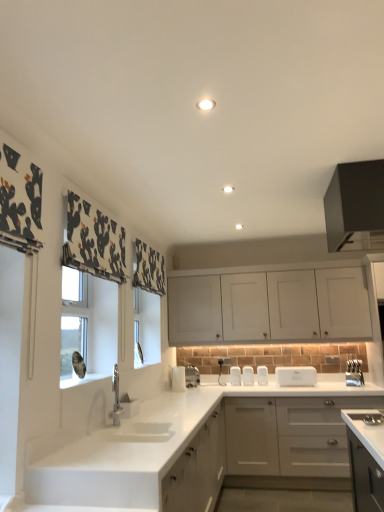
What are the coordinates of `free point in front of silver metallic knife block at right, which is counted as the first appliance, starting from the right` in the screenshot? It's located at (363, 386).